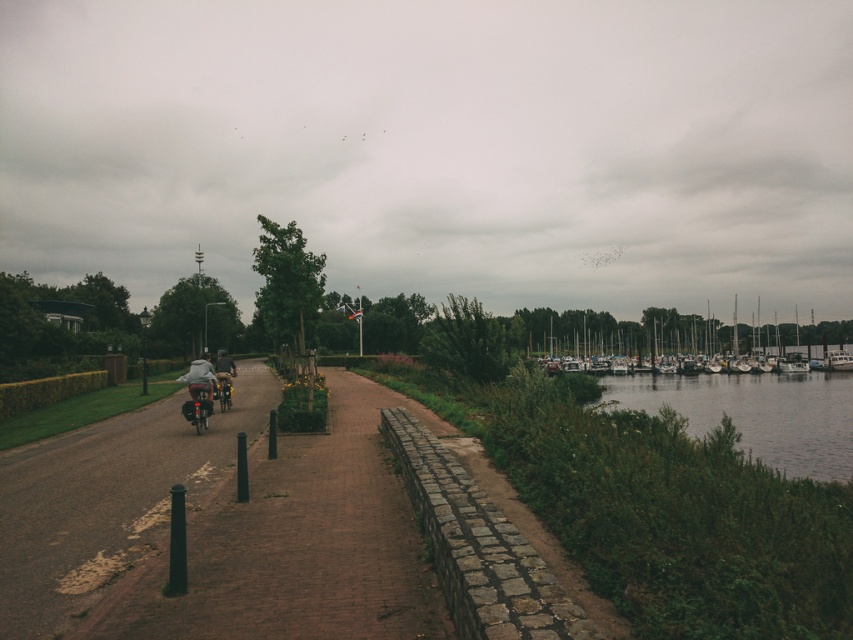
Question: Among these objects, which one is farthest from the camera?

Choices:
 (A) matte gray jacket at left
 (B) matte black motorcycle at lower left

Answer: (A)

Question: Is white matte boats at right wider than matte black motorcycle at lower left?

Choices:
 (A) no
 (B) yes

Answer: (B)

Question: Where is white matte boats at right located in relation to matte black motorcycle at lower left in the image?

Choices:
 (A) right
 (B) left

Answer: (A)

Question: Which point is closer to the camera?

Choices:
 (A) brown cobblestone path at center
 (B) matte black motorcycle at lower left
 (C) matte gray jacket at left

Answer: (A)

Question: Considering the real-world distances, which object is farthest from the matte black motorcycle at lower left?

Choices:
 (A) brown cobblestone path at center
 (B) white matte boats at right
 (C) matte gray jacket at left

Answer: (B)

Question: Does white matte boats at right have a smaller size compared to matte gray jacket at left?

Choices:
 (A) no
 (B) yes

Answer: (A)